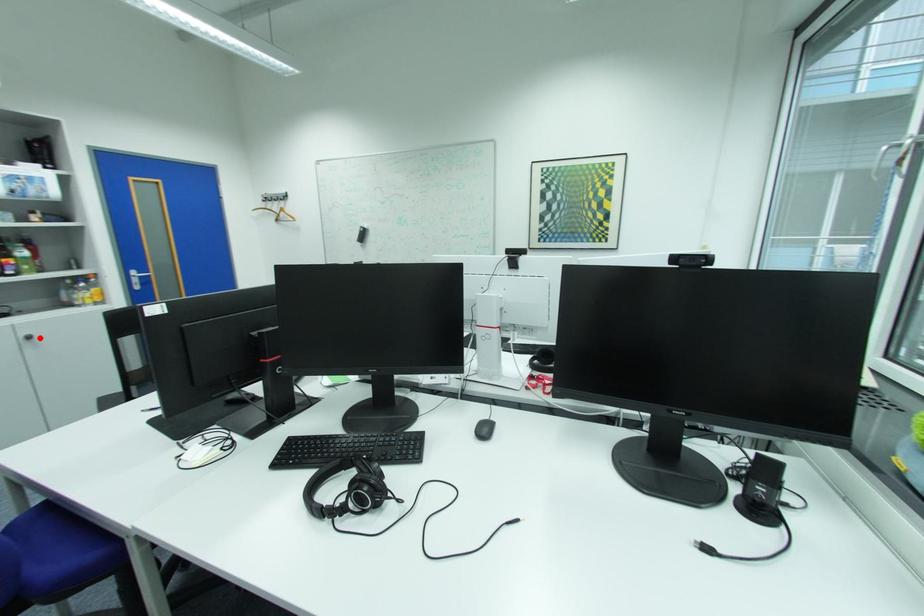
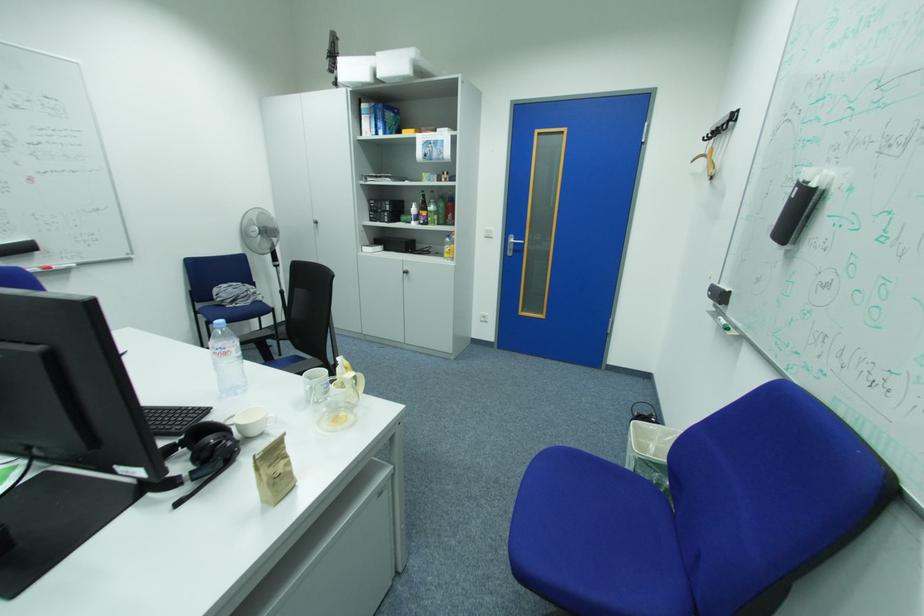
Locate, in the second image, the point that corresponds to the highlighted location in the first image.

(415, 273)